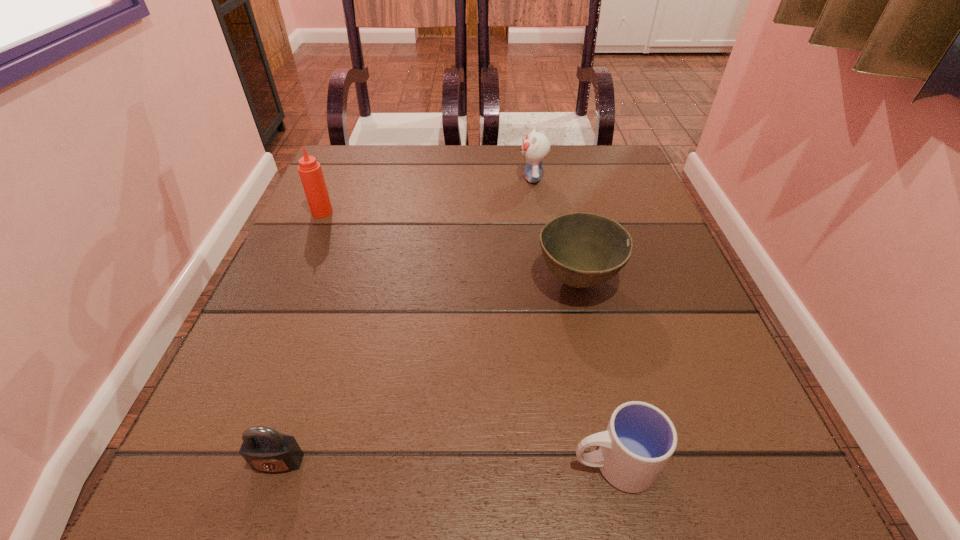
The image size is (960, 540). Find the location of `vacant area situated 0.300m on the front-facing side of the kitten`. vacant area situated 0.300m on the front-facing side of the kitten is located at coordinates (395, 178).

At what (x,y) coordinates should I click in order to perform the action: click on free space located on the front of the third farthest object. Please return your answer as a coordinate pair (x, y). This screenshot has height=540, width=960. Looking at the image, I should click on (589, 336).

You are a GUI agent. You are given a task and a screenshot of the screen. Output one action in this format:
    pyautogui.click(x=<x>, y=<y>)
    Task: Click on the vacant space located 0.370m with the handle on the side of the cup
    The width and height of the screenshot is (960, 540).
    Given the screenshot: What is the action you would take?
    pyautogui.click(x=288, y=463)

Find the location of a particular element. vacant space located 0.330m with the handle on the side of the cup is located at coordinates (319, 463).

What are the coordinates of `free space located with the handle on the side of the cup` in the screenshot? It's located at (533, 463).

Image resolution: width=960 pixels, height=540 pixels. What are the coordinates of `vacant space located on the front of the fourth object from right to left near the keyhole` in the screenshot? It's located at (260, 517).

Where is `object located in the far edge section of the desktop`? Image resolution: width=960 pixels, height=540 pixels. object located in the far edge section of the desktop is located at coordinates (535, 147).

Locate an element on the screen. cup located in the near edge section of the desktop is located at coordinates (640, 439).

This screenshot has width=960, height=540. What are the coordinates of `padlock situated at the near edge` in the screenshot? It's located at (264, 449).

Find the location of a particular element. The image size is (960, 540). Tabasco sauce positioned at the left edge is located at coordinates (311, 175).